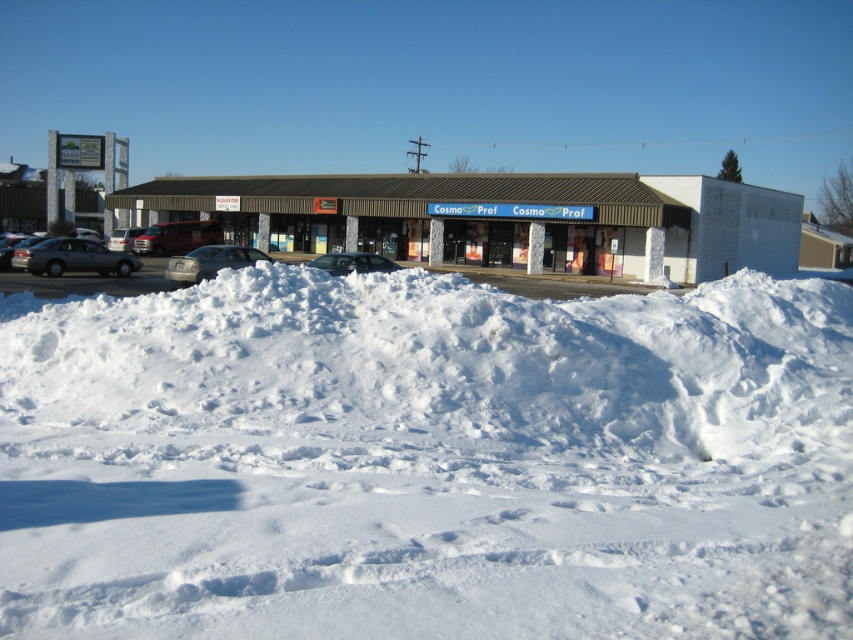
Question: Does satin silver sedan at left come in front of sleek silver sedan at center?

Choices:
 (A) yes
 (B) no

Answer: (B)

Question: Which object appears farthest from the camera in this image?

Choices:
 (A) satin silver sedan at center
 (B) white fluffy snow at lower center

Answer: (A)

Question: Is satin silver sedan at left thinner than metallic red truck at center?

Choices:
 (A) no
 (B) yes

Answer: (A)

Question: Which of the following is the closest to the observer?

Choices:
 (A) [144, 237]
 (B) [187, 257]

Answer: (B)

Question: Can you confirm if white fluffy snow at lower center is smaller than satin silver sedan at center?

Choices:
 (A) no
 (B) yes

Answer: (B)

Question: Which of the following is the farthest from the observer?

Choices:
 (A) brown/textured building at center
 (B) metallic red truck at center
 (C) silver metallic van at left

Answer: (C)